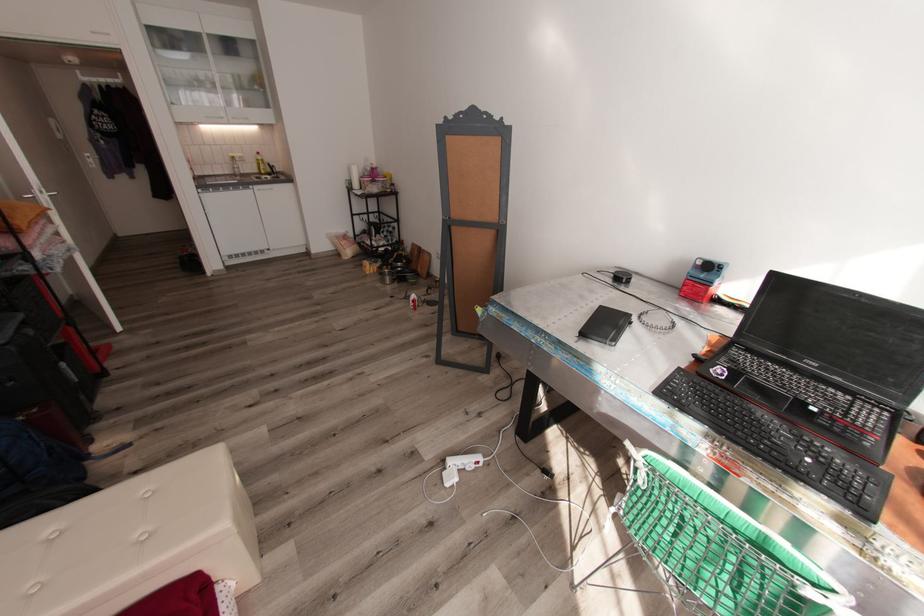
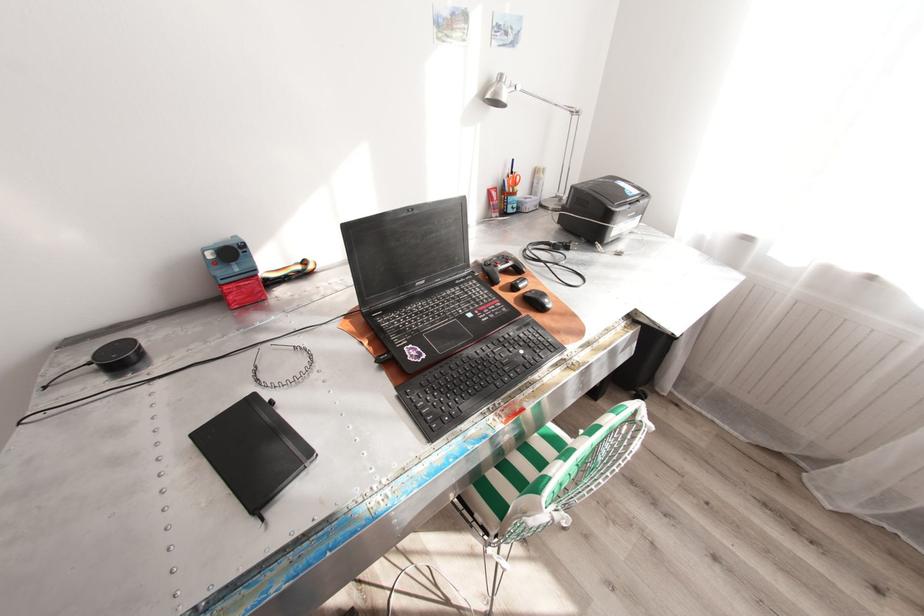
Find the pixel in the second image that matches point 703,262 in the first image.

(215, 254)